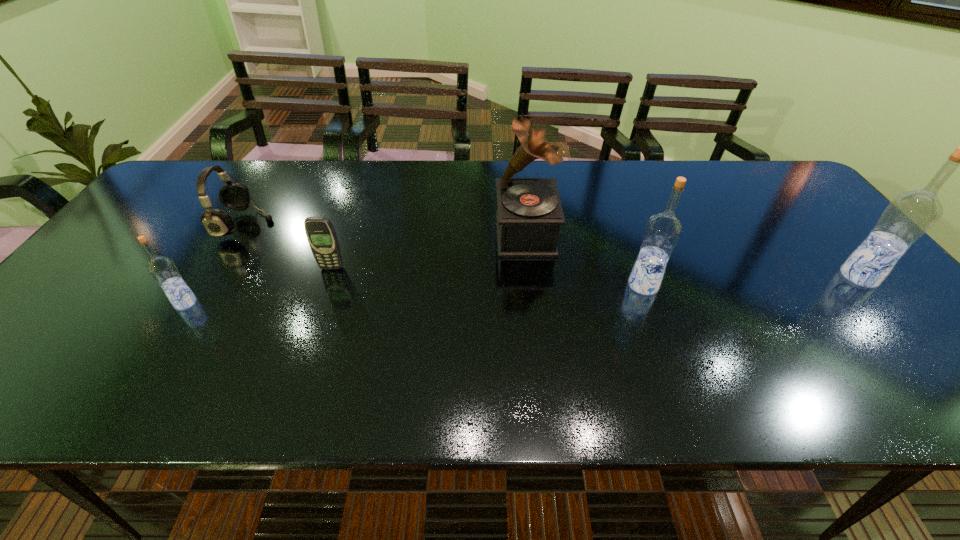
This screenshot has width=960, height=540. Find the location of `free space at the far left corner`. free space at the far left corner is located at coordinates (198, 167).

Find the location of a particular element. The height and width of the screenshot is (540, 960). vacant space at the near left corner of the desktop is located at coordinates (95, 341).

Locate an element on the screen. This screenshot has width=960, height=540. vacant area that lies between the fourth object from left to right and the third object from left to right is located at coordinates (428, 251).

Where is `free space between the phonograph_record and the headset`? This screenshot has height=540, width=960. free space between the phonograph_record and the headset is located at coordinates (386, 230).

The width and height of the screenshot is (960, 540). In order to click on free space between the second vodka from right to left and the fourth object from left to right in this screenshot , I will do `click(585, 260)`.

Identify the location of vacant space that's between the second tallest vodka and the phonograph_record. (585, 260).

In order to click on free space that is in between the leftmost vodka and the fourth object from right to left in this screenshot , I will do `click(258, 285)`.

Locate an element on the screen. free space between the rightmost vodka and the third object from left to right is located at coordinates (595, 272).

You are a GUI agent. You are given a task and a screenshot of the screen. Output one action in this format:
    pyautogui.click(x=<x>, y=<y>)
    Task: Click on the vacant area that lies between the leftmost vodka and the phonograph_record
    This screenshot has height=540, width=960.
    Given the screenshot: What is the action you would take?
    pyautogui.click(x=355, y=268)

Where is `unoccupied area between the headset and the cellular telephone`? The height and width of the screenshot is (540, 960). unoccupied area between the headset and the cellular telephone is located at coordinates (289, 246).